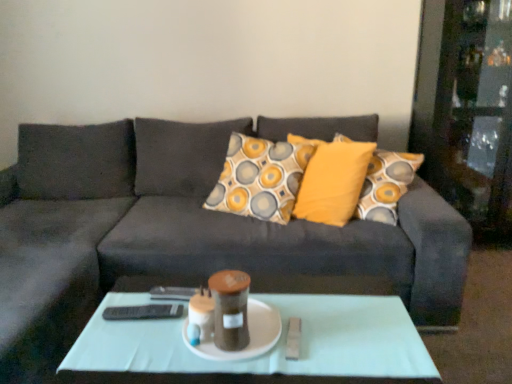
Question: Is light green glass coffee table at center smaller than dark gray fabric couch at center?

Choices:
 (A) no
 (B) yes

Answer: (B)

Question: Can you confirm if light green glass coffee table at center is positioned to the left of dark gray fabric couch at center?

Choices:
 (A) no
 (B) yes

Answer: (B)

Question: Is dark gray fabric couch at center a part of light green glass coffee table at center?

Choices:
 (A) no
 (B) yes

Answer: (A)

Question: Is light green glass coffee table at center facing towards dark gray fabric couch at center?

Choices:
 (A) yes
 (B) no

Answer: (A)

Question: Can you confirm if light green glass coffee table at center is wider than dark gray fabric couch at center?

Choices:
 (A) yes
 (B) no

Answer: (B)

Question: From a real-world perspective, does light green glass coffee table at center stand above dark gray fabric couch at center?

Choices:
 (A) yes
 (B) no

Answer: (B)

Question: From the image's perspective, would you say dark gray fabric couch at center is shown under white ceramic plate at center?

Choices:
 (A) yes
 (B) no

Answer: (B)

Question: Does dark gray fabric couch at center have a greater width compared to white ceramic plate at center?

Choices:
 (A) yes
 (B) no

Answer: (A)

Question: Is dark gray fabric couch at center closer to camera compared to white ceramic plate at center?

Choices:
 (A) no
 (B) yes

Answer: (B)

Question: From the image's perspective, is dark gray fabric couch at center on white ceramic plate at center?

Choices:
 (A) yes
 (B) no

Answer: (A)

Question: From a real-world perspective, does dark gray fabric couch at center stand above white ceramic plate at center?

Choices:
 (A) no
 (B) yes

Answer: (A)

Question: Can you confirm if dark gray fabric couch at center is taller than white ceramic plate at center?

Choices:
 (A) yes
 (B) no

Answer: (A)

Question: Does white ceramic plate at center appear on the right side of dark gray fabric couch at center?

Choices:
 (A) yes
 (B) no

Answer: (B)